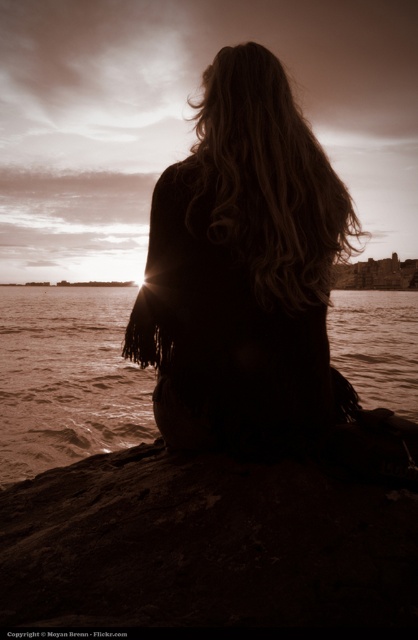
You are a photographer trying to capture the subject from the front. The subject is facing away from you towards the horizon. If you move to the right side to get a better angle, will the dark brown hair at center still block your view of the brown water at center?

Yes, the dark brown hair at center is in front of the brown water at center, so moving to the right side might still keep the hair between you and the water, blocking the view.

You are a photographer trying to capture the scene. You notice the dark brown hair at center and the brown water at center. Which object is located to the left of the other?

The dark brown hair at center is positioned on the left side of brown water at center.

Based on the scene described, which object takes up more space in the image? Please choose between the dark brown hair at center and the brown water at center.

The brown water at center takes up more space than the dark brown hair at center because the dark brown hair at center occupies less space than brown water at center.